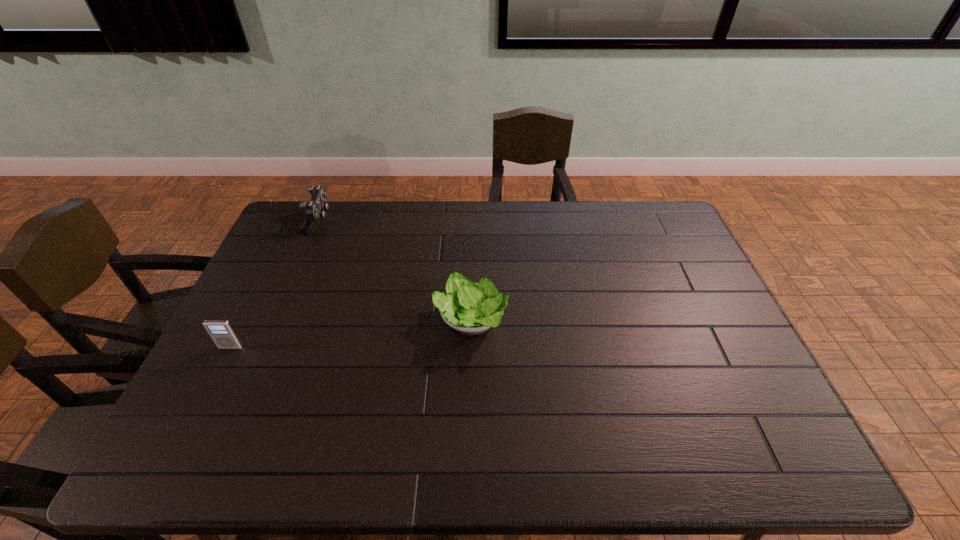
Where is `blank space that satisfies the following two spatial constraints: 1. on the surface of the control with buttons; 2. on the front-facing side of the iPod`? blank space that satisfies the following two spatial constraints: 1. on the surface of the control with buttons; 2. on the front-facing side of the iPod is located at coordinates (263, 347).

The height and width of the screenshot is (540, 960). In order to click on vacant area in the image that satisfies the following two spatial constraints: 1. on the surface of the farthest object with buttons; 2. on the left side of the lettuce in this screenshot , I will do `click(275, 321)`.

At what (x,y) coordinates should I click in order to perform the action: click on vacant region that satisfies the following two spatial constraints: 1. on the surface of the rightmost object with buttons; 2. on the left side of the control. Please return your answer as a coordinate pair (x, y). The width and height of the screenshot is (960, 540). Looking at the image, I should click on (275, 321).

This screenshot has width=960, height=540. Identify the location of blank space that satisfies the following two spatial constraints: 1. on the surface of the farthest object with buttons; 2. on the front-facing side of the iPod. (263, 347).

The height and width of the screenshot is (540, 960). Identify the location of vacant position in the image that satisfies the following two spatial constraints: 1. on the surface of the second object from left to right with buttons; 2. on the front-facing side of the iPod. (263, 347).

This screenshot has height=540, width=960. Find the location of `vacant space that satisfies the following two spatial constraints: 1. on the surface of the control with buttons; 2. on the back side of the rightmost object`. vacant space that satisfies the following two spatial constraints: 1. on the surface of the control with buttons; 2. on the back side of the rightmost object is located at coordinates (275, 321).

Locate an element on the screen. vacant area that satisfies the following two spatial constraints: 1. on the surface of the control with buttons; 2. on the left side of the rightmost object is located at coordinates (275, 321).

This screenshot has height=540, width=960. In order to click on free space that satisfies the following two spatial constraints: 1. on the surface of the control with buttons; 2. on the front-facing side of the iPod in this screenshot , I will do `click(263, 347)`.

Image resolution: width=960 pixels, height=540 pixels. In order to click on vacant space that satisfies the following two spatial constraints: 1. on the surface of the second object from right to left with buttons; 2. on the front-facing side of the leftmost object in this screenshot , I will do `click(263, 347)`.